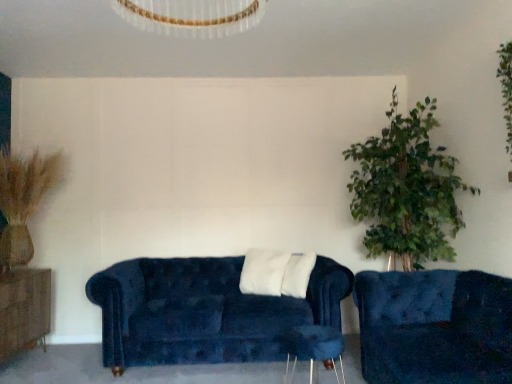
Question: Is velvet blue couch at center, which is counted as the 2th studio couch, starting from the front, turned away from brown wood dresser at left?

Choices:
 (A) yes
 (B) no

Answer: (B)

Question: Is velvet blue couch at center, positioned as the first studio couch in back-to-front order, positioned before brown wood dresser at left?

Choices:
 (A) no
 (B) yes

Answer: (A)

Question: Can you confirm if velvet blue couch at center, placed as the first studio couch when sorted from left to right, is shorter than brown wood dresser at left?

Choices:
 (A) yes
 (B) no

Answer: (B)

Question: Can you confirm if velvet blue couch at center, which is counted as the 2th studio couch, starting from the front, is positioned to the right of brown wood dresser at left?

Choices:
 (A) no
 (B) yes

Answer: (B)

Question: Considering the relative sizes of velvet blue couch at center, positioned as the second studio couch in right-to-left order, and brown wood dresser at left in the image provided, is velvet blue couch at center, positioned as the second studio couch in right-to-left order, wider than brown wood dresser at left?

Choices:
 (A) no
 (B) yes

Answer: (B)

Question: Is velvet blue couch at center, positioned as the second studio couch in right-to-left order, further to the viewer compared to brown wood dresser at left?

Choices:
 (A) yes
 (B) no

Answer: (A)

Question: Can we say brown wood dresser at left lies outside velvet blue couch at lower right, the second studio couch viewed from the back?

Choices:
 (A) yes
 (B) no

Answer: (A)

Question: Is the surface of brown wood dresser at left in direct contact with velvet blue couch at lower right, which appears as the 1th studio couch when viewed from the right?

Choices:
 (A) no
 (B) yes

Answer: (A)

Question: Does brown wood dresser at left have a smaller size compared to velvet blue couch at lower right, which is the 1th studio couch from front to back?

Choices:
 (A) yes
 (B) no

Answer: (A)

Question: Is brown wood dresser at left oriented towards velvet blue couch at lower right, the 2th studio couch when ordered from left to right?

Choices:
 (A) yes
 (B) no

Answer: (A)

Question: Can you confirm if brown wood dresser at left is thinner than velvet blue couch at lower right, which is the 1th studio couch from front to back?

Choices:
 (A) no
 (B) yes

Answer: (B)

Question: From a real-world perspective, is brown wood dresser at left positioned under velvet blue couch at lower right, which appears as the 1th studio couch when viewed from the right, based on gravity?

Choices:
 (A) yes
 (B) no

Answer: (A)

Question: Is velvet blue couch at lower right, the 2th studio couch when ordered from left to right, in contact with wooden side table at lower center?

Choices:
 (A) no
 (B) yes

Answer: (A)